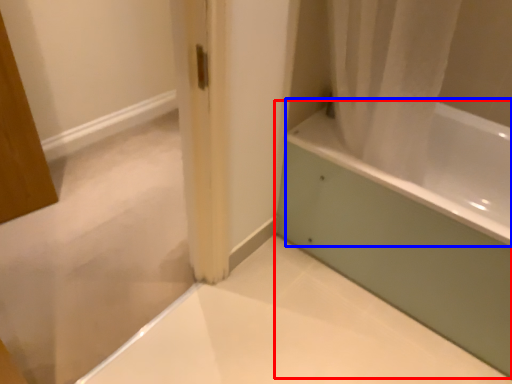
Question: Which object appears farthest to the camera in this image, bathtub (highlighted by a red box) or bath (highlighted by a blue box)?

Choices:
 (A) bathtub
 (B) bath

Answer: (A)